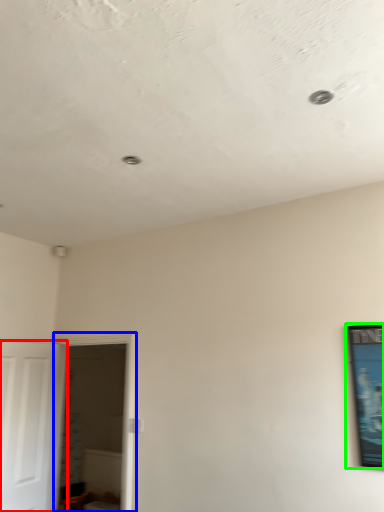
Question: Which object is the closest to the door (highlighted by a red box)? Choose among these: glass door (highlighted by a blue box) or picture frame (highlighted by a green box).

Choices:
 (A) glass door
 (B) picture frame

Answer: (A)